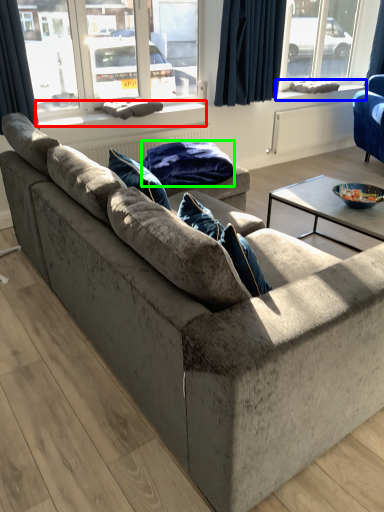
Question: Considering the real-world distances, which object is closest to window sill (highlighted by a red box)? window sill (highlighted by a blue box) or material (highlighted by a green box).

Choices:
 (A) window sill
 (B) material

Answer: (B)